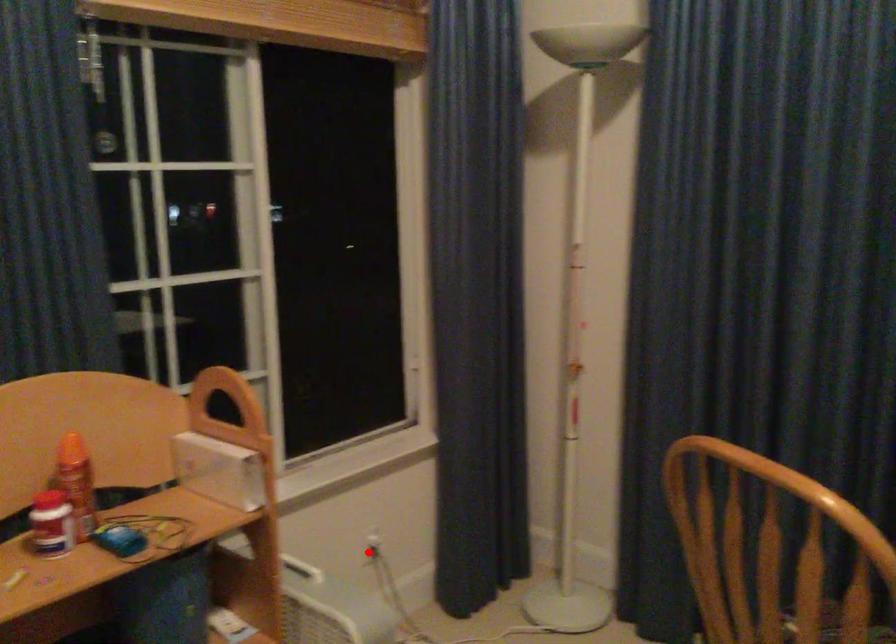
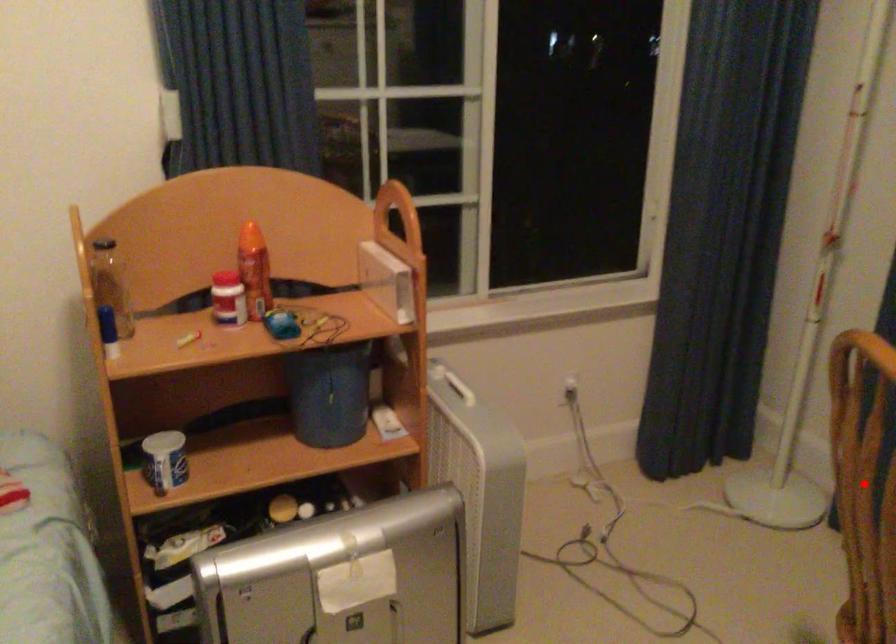
I am providing you with two images of the same scene from different viewpoints. A red point is marked on the first image and another point is marked on the second image. Does the point marked in image1 correspond to the same location as the one in image2?

No